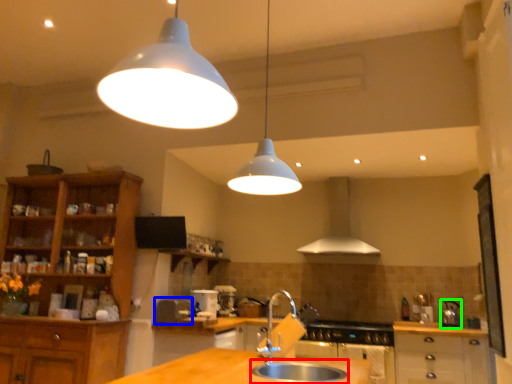
Question: Which object is positioned farthest from sink (highlighted by a red box)? Select from appliance (highlighted by a blue box) and appliance (highlighted by a green box).

Choices:
 (A) appliance
 (B) appliance

Answer: (B)